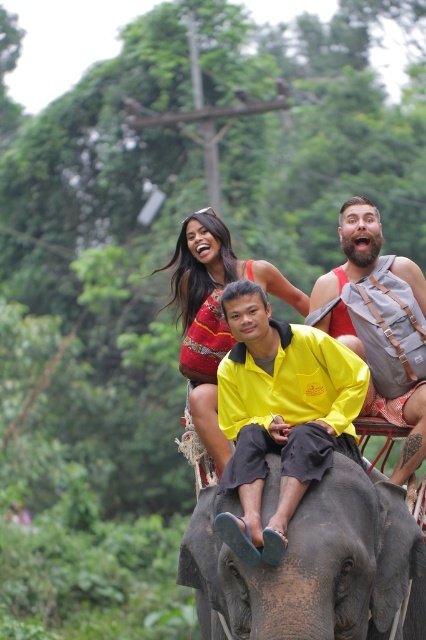
Does gray matte elephant at center have a smaller size compared to yellow matte shirt at center?

Incorrect, gray matte elephant at center is not smaller in size than yellow matte shirt at center.

Is point (351, 580) farther from viewer compared to point (261, 323)?

No, it is not.

Is point (336, 509) positioned in front of point (265, 314)?

That is True.

Where is `gray matte elephant at center`? This screenshot has height=640, width=426. gray matte elephant at center is located at coordinates (313, 564).

Is yellow matte shirt at center wider than reddish-brown fabric dress at upper center?

No, yellow matte shirt at center is not wider than reddish-brown fabric dress at upper center.

Which is above, yellow matte shirt at center or reddish-brown fabric dress at upper center?

reddish-brown fabric dress at upper center

Is point (230, 428) more distant than point (193, 422)?

No.

The height and width of the screenshot is (640, 426). Identify the location of yellow matte shirt at center. (279, 413).

In the scene shown: Can you confirm if bearded man with backpack at upper right is positioned above reddish-brown fabric dress at upper center?

Incorrect, bearded man with backpack at upper right is not positioned above reddish-brown fabric dress at upper center.

Can you confirm if bearded man with backpack at upper right is thinner than reddish-brown fabric dress at upper center?

Yes, bearded man with backpack at upper right is thinner than reddish-brown fabric dress at upper center.

Does point (334, 324) lie in front of point (183, 321)?

Yes.

Where is `bearded man with backpack at upper right`? This screenshot has height=640, width=426. bearded man with backpack at upper right is located at coordinates (379, 324).